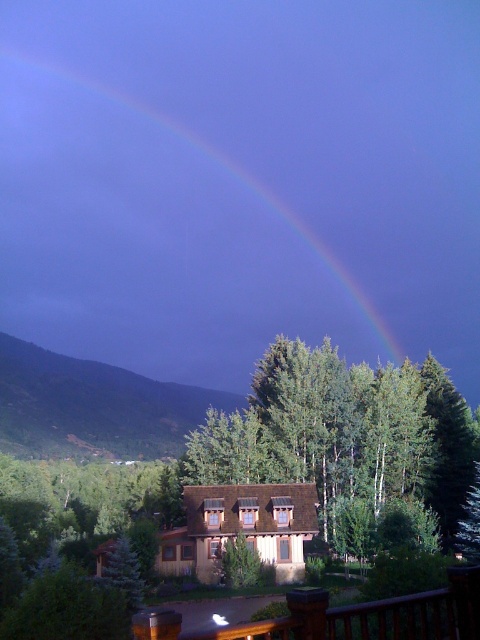
Question: Is rainbow at upper center below green leafy tree at center?

Choices:
 (A) yes
 (B) no

Answer: (B)

Question: Which of the following is the farthest from the observer?

Choices:
 (A) (34, 304)
 (B) (295, 445)

Answer: (A)

Question: Can you confirm if rainbow at upper center is positioned to the right of green leafy tree at center?

Choices:
 (A) yes
 (B) no

Answer: (B)

Question: Which point is closer to the camera?

Choices:
 (A) green leafy tree at center
 (B) rainbow at upper center

Answer: (A)

Question: Does rainbow at upper center have a greater width compared to green leafy tree at center?

Choices:
 (A) no
 (B) yes

Answer: (B)